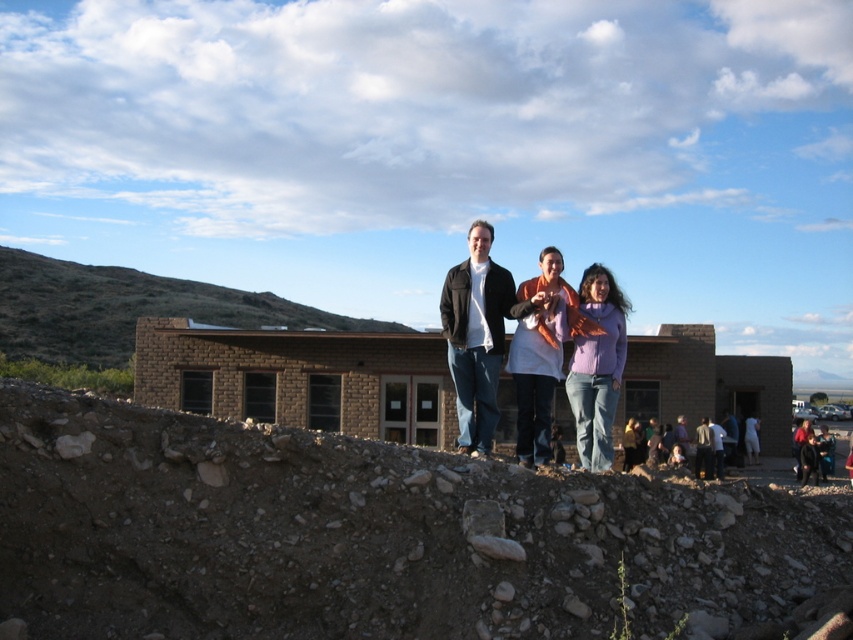
Is rough stone hill at lower left shorter than black leather jacket at center?

Yes.

Is point (198, 560) positioned before point (798, 428)?

That is True.

This screenshot has height=640, width=853. Identify the location of rough stone hill at lower left. (370, 536).

Locate an element on the screen. This screenshot has width=853, height=640. rough stone hill at lower left is located at coordinates (370, 536).

Which is behind, point (477, 508) or point (538, 340)?

Positioned behind is point (538, 340).

What do you see at coordinates (370, 536) in the screenshot? I see `rough stone hill at lower left` at bounding box center [370, 536].

In order to click on rough stone hill at lower left in this screenshot , I will do `click(370, 536)`.

Does matte black jacket at center have a greater width compared to dark gray shirt at center?

Yes, matte black jacket at center is wider than dark gray shirt at center.

Is point (519, 305) farther from viewer compared to point (699, 464)?

No, it is in front of (699, 464).

Identify the location of matte black jacket at center. This screenshot has height=640, width=853. (479, 336).